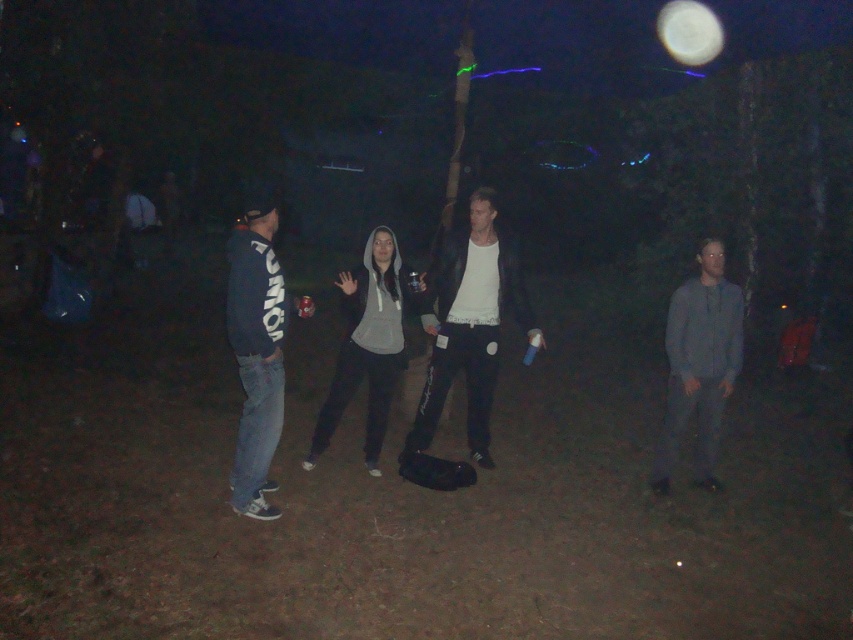
Is dark blue hoodie at left wider than dark gray hoodie at center?

Yes.

How far apart are dark blue hoodie at left and dark gray hoodie at center?

They are 1.76 meters apart.

Where is `dark blue hoodie at left`? This screenshot has width=853, height=640. dark blue hoodie at left is located at coordinates (256, 349).

This screenshot has height=640, width=853. In order to click on dark blue hoodie at left in this screenshot , I will do `click(256, 349)`.

Does dark blue hoodie at left have a lesser height compared to gray cotton shirt at right?

In fact, dark blue hoodie at left may be taller than gray cotton shirt at right.

Is dark blue hoodie at left wider than gray cotton shirt at right?

Indeed, dark blue hoodie at left has a greater width compared to gray cotton shirt at right.

The width and height of the screenshot is (853, 640). Identify the location of dark blue hoodie at left. (256, 349).

You are a GUI agent. You are given a task and a screenshot of the screen. Output one action in this format:
    pyautogui.click(x=<x>, y=<y>)
    Task: Click on the dark blue hoodie at left
    The width and height of the screenshot is (853, 640).
    Given the screenshot: What is the action you would take?
    pyautogui.click(x=256, y=349)

Does white matte jacket at center appear on the left side of dark gray hoodie at center?

No, white matte jacket at center is not to the left of dark gray hoodie at center.

Between white matte jacket at center and dark gray hoodie at center, which one appears on the left side from the viewer's perspective?

From the viewer's perspective, dark gray hoodie at center appears more on the left side.

What do you see at coordinates (471, 324) in the screenshot?
I see `white matte jacket at center` at bounding box center [471, 324].

Locate an element on the screen. white matte jacket at center is located at coordinates (471, 324).